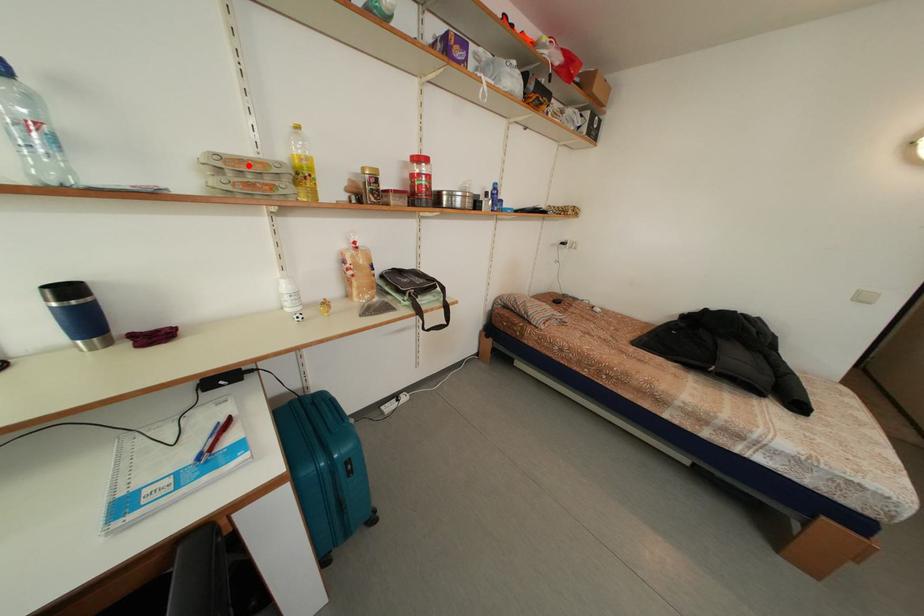
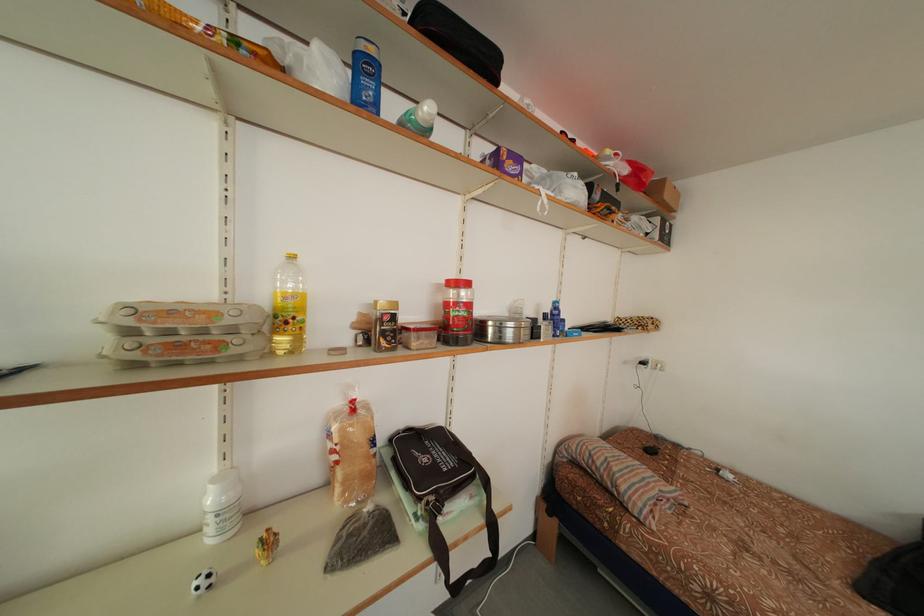
Find the pixel in the second image that matches the highlighted location in the first image.

(178, 317)